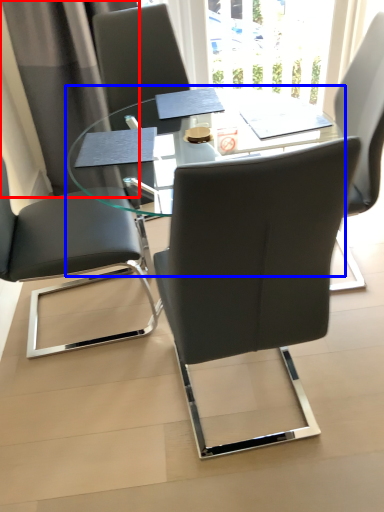
Question: Which of the following is the farthest to the observer, curtain (highlighted by a red box) or table (highlighted by a blue box)?

Choices:
 (A) curtain
 (B) table

Answer: (A)